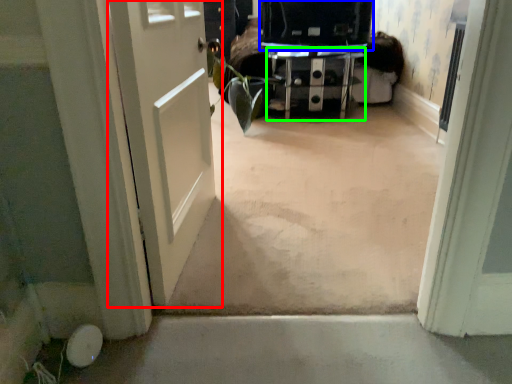
Question: Which object is the closest to the door (highlighted by a red box)? Choose among these: back (highlighted by a blue box) or furniture (highlighted by a green box).

Choices:
 (A) back
 (B) furniture

Answer: (A)